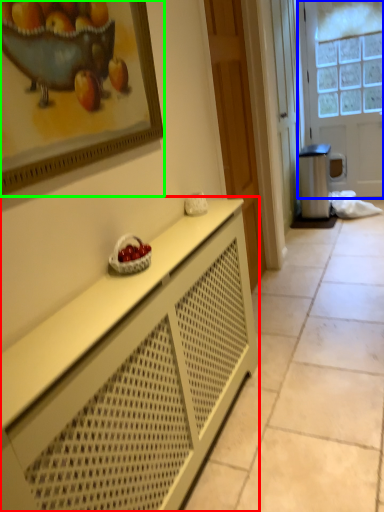
Question: Based on their relative distances, which object is farther from cabinetry (highlighted by a red box)? Choose from door (highlighted by a blue box) and picture frame (highlighted by a green box).

Choices:
 (A) door
 (B) picture frame

Answer: (A)